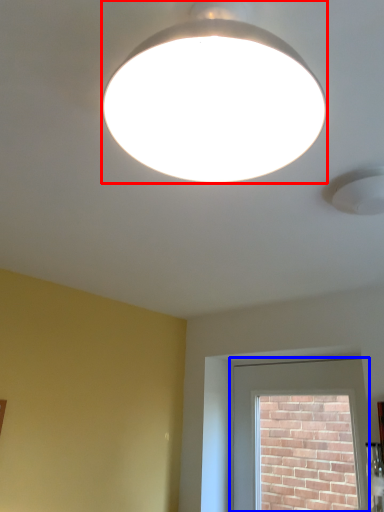
Question: Among these objects, which one is farthest to the camera, lamp (highlighted by a red box) or window (highlighted by a blue box)?

Choices:
 (A) lamp
 (B) window

Answer: (B)